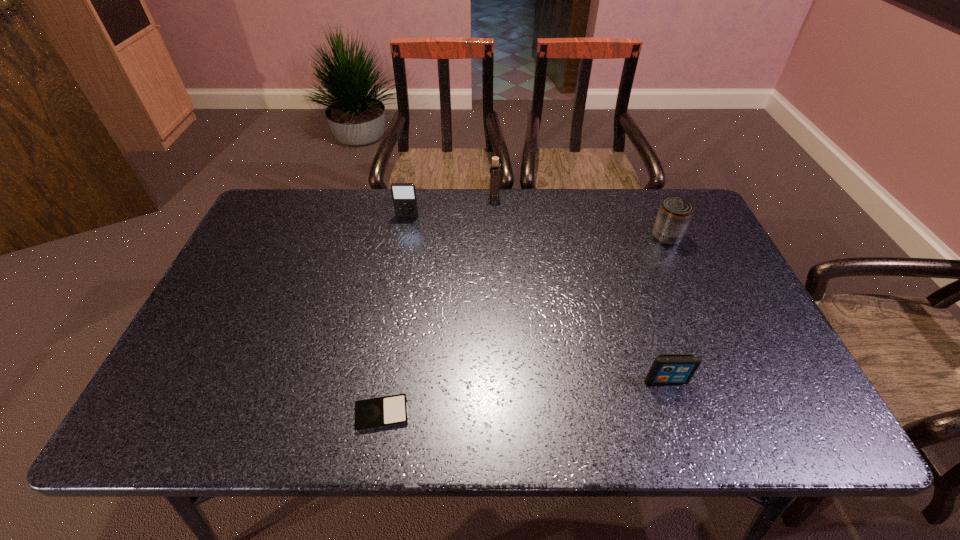
The image size is (960, 540). In order to click on iPod that can be found as the third closest to the can in this screenshot , I will do `click(387, 411)`.

This screenshot has height=540, width=960. In order to click on blank space that satisfies the following two spatial constraints: 1. on the front-facing side of the tallest iPod; 2. on the right side of the shortest iPod in this screenshot , I will do `click(371, 414)`.

Image resolution: width=960 pixels, height=540 pixels. Identify the location of vacant space that satisfies the following two spatial constraints: 1. on the front-facing side of the can; 2. on the left side of the tallest iPod. (403, 237).

Where is `free location that satisfies the following two spatial constraints: 1. on the front-facing side of the nearest iPod; 2. on the left side of the fourth nearest object`? The height and width of the screenshot is (540, 960). free location that satisfies the following two spatial constraints: 1. on the front-facing side of the nearest iPod; 2. on the left side of the fourth nearest object is located at coordinates (371, 414).

I want to click on blank space that satisfies the following two spatial constraints: 1. on the front side of the third object from left to right; 2. on the left side of the rightmost object, so [x=496, y=237].